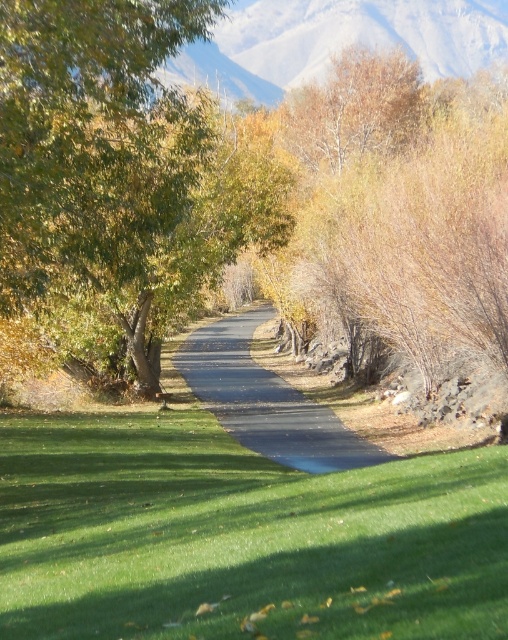
You are standing at the point marked by the coordinates point [239,536] in the image. Based on the scene description, what type of terrain or surface are you currently standing on?

The point [239,536] marks green grass at center, so you are standing on green grass.

You are a hiker planning to take a photo of the smooth gray mountain at upper center and the black asphalt road at center from your current position. Which object will appear closer to the top of your camera frame?

The smooth gray mountain at upper center is positioned over the black asphalt road at center, so it will appear closer to the top of the camera frame.

In the scene shown: You are standing at the point marked as point (429, 28) in the image. A hiker wants to walk from your current position to the base of the mountains in the background. Is the path clear of obstacles between your current position and the mountains?

The path between point (429, 28) and the mountains is clear of obstacles as there are no objects blocking the way according to the scene description.